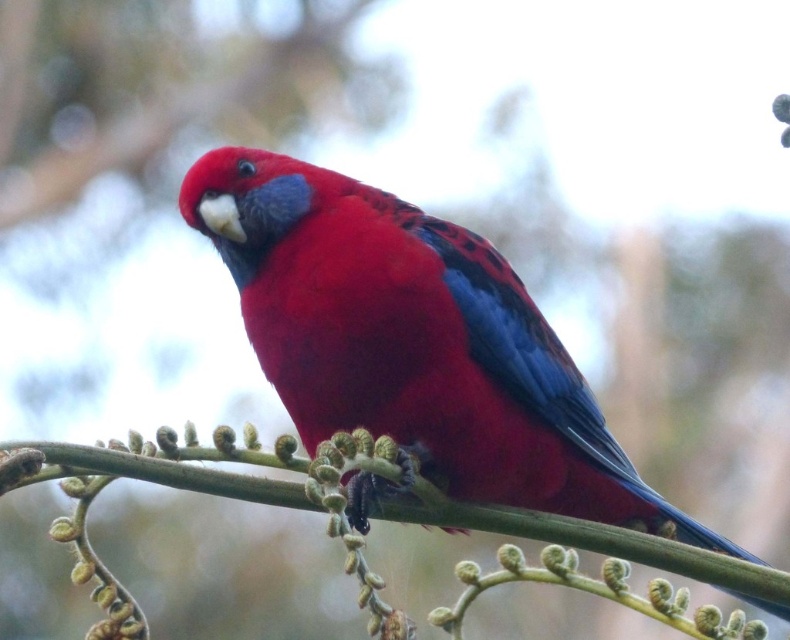
You are a photographer trying to capture the matte red parrot at center. Based on the coordinates provided, where should you aim your camera?

The matte red parrot at center is located at coordinates point (414, 340), so aim your camera at that point to capture it.

In the scene shown: You are an ornithologist observing a bird in a botanical garden. You notice a matte red parrot at center and a green textured branch at center. Based on their positions, which object is located to the left of the other?

The matte red parrot at center is positioned on the right side of green textured branch at center, so the green textured branch at center is to the left of the matte red parrot at center.